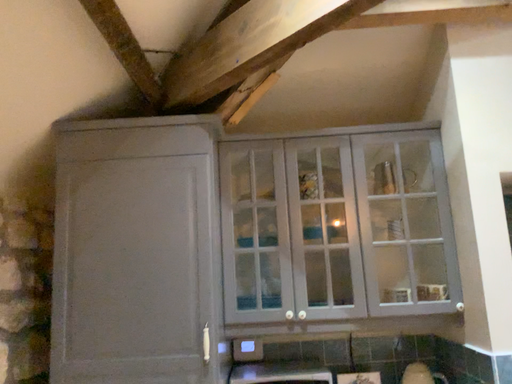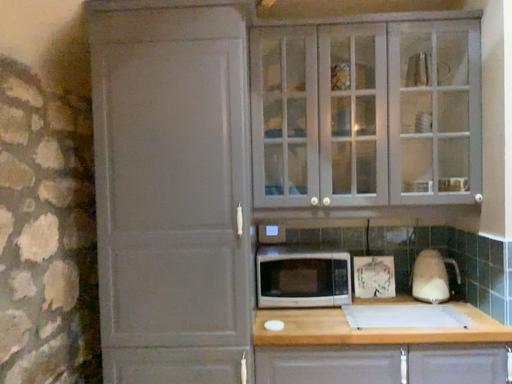
Question: Which way did the camera rotate in the video?

Choices:
 (A) rotated upward
 (B) rotated downward

Answer: (B)